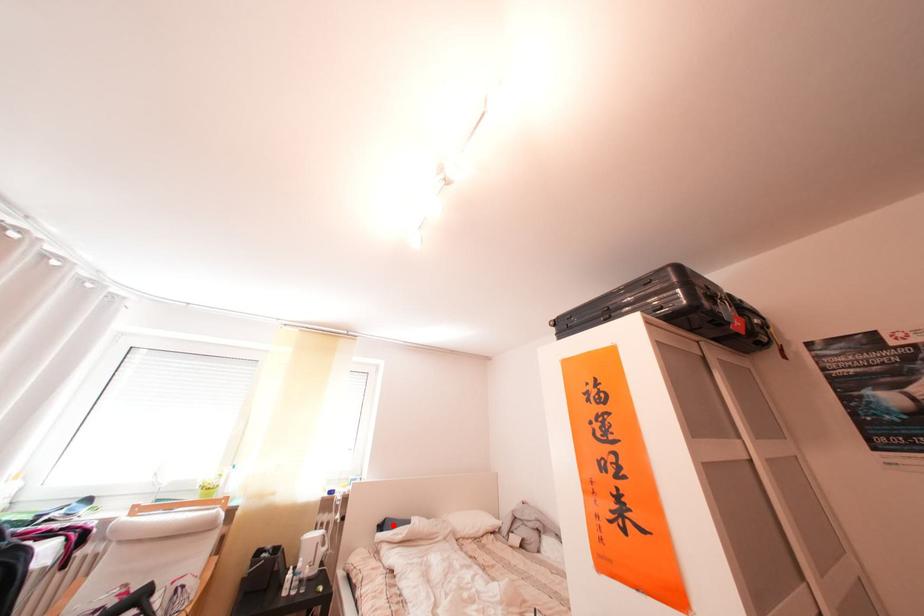
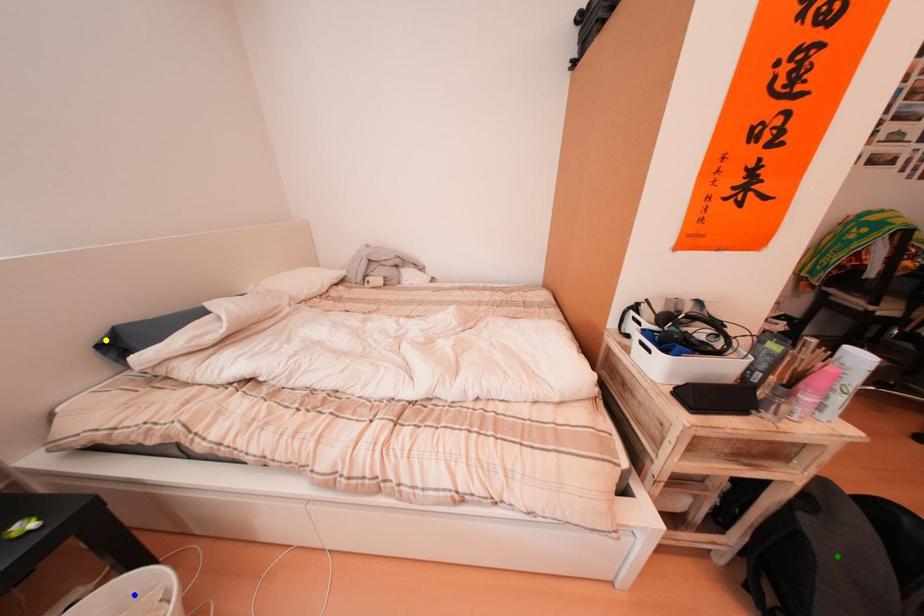
Question: I am providing you with two images of the same scene from different viewpoints. A red point is marked on the first image. You are given multiple points on the second image. Which spot in image 2 lines up with the point in image 1?

Choices:
 (A) green point
 (B) blue point
 (C) yellow point

Answer: (C)